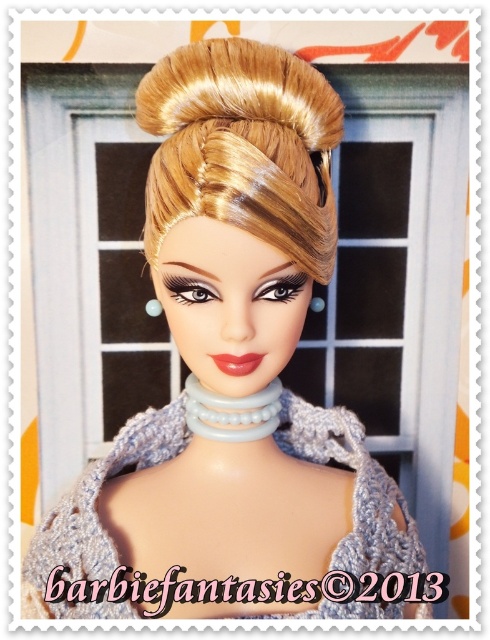
Question: Which point appears farthest from the camera in this image?

Choices:
 (A) (266, 184)
 (B) (391, 538)

Answer: (B)

Question: Is blonde shiny hair bun at upper center above crochet fabric dress at center?

Choices:
 (A) no
 (B) yes

Answer: (B)

Question: Does blonde shiny hair bun at upper center appear on the left side of crochet fabric dress at center?

Choices:
 (A) no
 (B) yes

Answer: (A)

Question: Is blonde shiny hair bun at upper center smaller than crochet fabric dress at center?

Choices:
 (A) yes
 (B) no

Answer: (A)